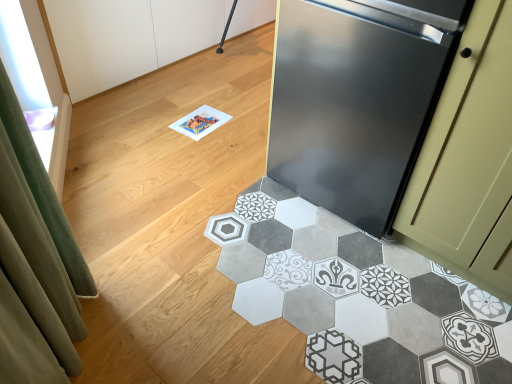
Question: Can you confirm if patterned tile floor at lower right is positioned to the left of stainless steel refrigerator at right?

Choices:
 (A) no
 (B) yes

Answer: (B)

Question: Can you confirm if patterned tile floor at lower right is thinner than stainless steel refrigerator at right?

Choices:
 (A) no
 (B) yes

Answer: (A)

Question: From the image's perspective, is patterned tile floor at lower right beneath stainless steel refrigerator at right?

Choices:
 (A) no
 (B) yes

Answer: (B)

Question: Does patterned tile floor at lower right have a greater width compared to stainless steel refrigerator at right?

Choices:
 (A) yes
 (B) no

Answer: (A)

Question: Is patterned tile floor at lower right beside stainless steel refrigerator at right?

Choices:
 (A) yes
 (B) no

Answer: (B)

Question: Considering the relative positions of patterned tile floor at lower right and stainless steel refrigerator at right in the image provided, is patterned tile floor at lower right to the right of stainless steel refrigerator at right from the viewer's perspective?

Choices:
 (A) no
 (B) yes

Answer: (A)

Question: Is patterned tile floor at lower right located within stainless steel refrigerator at right?

Choices:
 (A) no
 (B) yes

Answer: (A)

Question: Is stainless steel refrigerator at right further to camera compared to patterned tile floor at lower right?

Choices:
 (A) yes
 (B) no

Answer: (A)

Question: Does stainless steel refrigerator at right lie in front of patterned tile floor at lower right?

Choices:
 (A) no
 (B) yes

Answer: (A)

Question: Is stainless steel refrigerator at right located outside patterned tile floor at lower right?

Choices:
 (A) yes
 (B) no

Answer: (A)

Question: Is stainless steel refrigerator at right next to patterned tile floor at lower right and touching it?

Choices:
 (A) yes
 (B) no

Answer: (B)

Question: Is stainless steel refrigerator at right facing away from patterned tile floor at lower right?

Choices:
 (A) yes
 (B) no

Answer: (B)

Question: Based on their sizes in the image, would you say stainless steel refrigerator at right is bigger or smaller than patterned tile floor at lower right?

Choices:
 (A) small
 (B) big

Answer: (B)